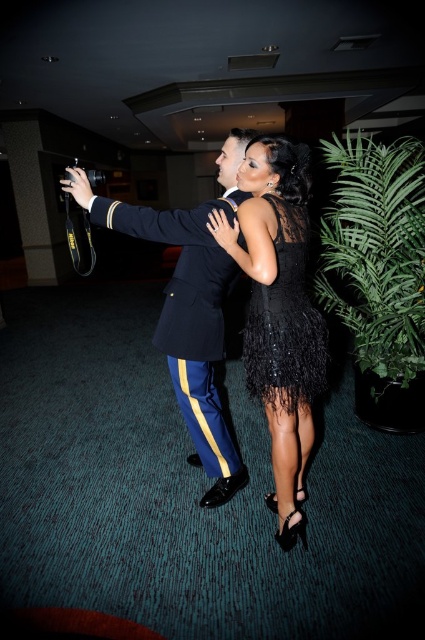
Question: Does black sequined dress at center have a lesser width compared to navy blue fabric uniform at center?

Choices:
 (A) no
 (B) yes

Answer: (B)

Question: Does navy blue fabric uniform at center lie behind black feathered dress at center?

Choices:
 (A) no
 (B) yes

Answer: (B)

Question: Which point appears closest to the camera in this image?

Choices:
 (A) (323, 381)
 (B) (246, 132)

Answer: (A)

Question: Which point is farther from the camera taking this photo?

Choices:
 (A) (195, 385)
 (B) (288, 346)

Answer: (A)

Question: Can you confirm if shiny black dress at center is positioned to the right of navy blue fabric uniform at center?

Choices:
 (A) no
 (B) yes

Answer: (B)

Question: Based on their relative distances, which object is farther from the black feathered dress at center?

Choices:
 (A) shiny black dress at center
 (B) black sequined dress at center

Answer: (A)